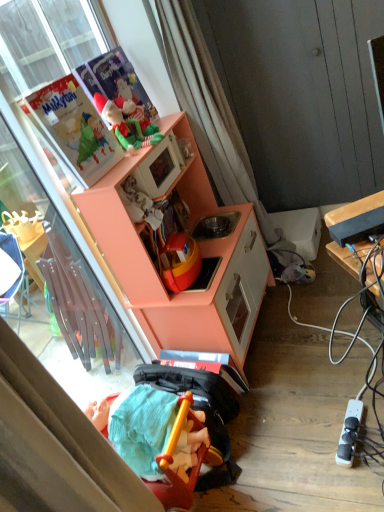
Question: From a real-world perspective, is white plastic power outlet at lower right on top of peach matte cabinet at upper left?

Choices:
 (A) yes
 (B) no

Answer: (B)

Question: Considering the relative sizes of white plastic power outlet at lower right and peach matte cabinet at upper left in the image provided, is white plastic power outlet at lower right wider than peach matte cabinet at upper left?

Choices:
 (A) no
 (B) yes

Answer: (A)

Question: Considering the relative positions of white plastic power outlet at lower right and peach matte cabinet at upper left in the image provided, is white plastic power outlet at lower right to the left of peach matte cabinet at upper left from the viewer's perspective?

Choices:
 (A) no
 (B) yes

Answer: (A)

Question: Is white plastic power outlet at lower right closer to camera compared to peach matte cabinet at upper left?

Choices:
 (A) yes
 (B) no

Answer: (B)

Question: Are white plastic power outlet at lower right and peach matte cabinet at upper left located far from each other?

Choices:
 (A) no
 (B) yes

Answer: (A)

Question: From the image's perspective, is rubberized plastic toy at lower center, placed as the first toy when sorted from front to back, positioned above or below white sheer curtain at upper center?

Choices:
 (A) above
 (B) below

Answer: (B)

Question: Considering the positions of rubberized plastic toy at lower center, the 2th toy from the back, and white sheer curtain at upper center in the image, is rubberized plastic toy at lower center, the 2th toy from the back, wider or thinner than white sheer curtain at upper center?

Choices:
 (A) wide
 (B) thin

Answer: (A)

Question: Visually, is rubberized plastic toy at lower center, placed as the first toy when sorted from front to back, positioned to the left or to the right of white sheer curtain at upper center?

Choices:
 (A) left
 (B) right

Answer: (A)

Question: Considering their positions, is rubberized plastic toy at lower center, arranged as the 2th toy when viewed from the top, located in front of or behind white sheer curtain at upper center?

Choices:
 (A) behind
 (B) front

Answer: (B)

Question: From a real-world perspective, relative to peach matte cabinet at upper left, is rubberized plastic toy at lower center, arranged as the 2th toy when viewed from the top, vertically above or below?

Choices:
 (A) above
 (B) below

Answer: (B)

Question: Is point (134, 451) closer or farther from the camera than point (104, 202)?

Choices:
 (A) farther
 (B) closer

Answer: (B)

Question: Looking at their shapes, would you say rubberized plastic toy at lower center, which appears as the 1th toy when ordered from the bottom, is wider or thinner than peach matte cabinet at upper left?

Choices:
 (A) wide
 (B) thin

Answer: (B)

Question: Relative to peach matte cabinet at upper left, is rubberized plastic toy at lower center, the 2th toy from the back, in front or behind?

Choices:
 (A) front
 (B) behind

Answer: (A)

Question: In terms of height, does peach matte cabinet at upper left look taller or shorter compared to green felt elf at upper center, the 2th toy when ordered from front to back?

Choices:
 (A) tall
 (B) short

Answer: (A)

Question: Considering the positions of peach matte cabinet at upper left and green felt elf at upper center, the 2th toy when ordered from front to back, in the image, is peach matte cabinet at upper left wider or thinner than green felt elf at upper center, the 2th toy when ordered from front to back,?

Choices:
 (A) wide
 (B) thin

Answer: (A)